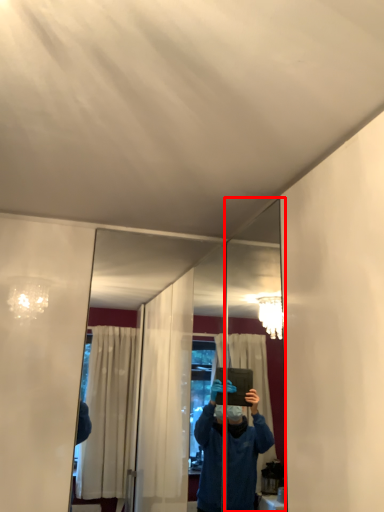
Question: From the image's perspective, considering the relative positions of mirror (annotated by the red box) and mirror in the image provided, where is mirror (annotated by the red box) located with respect to the staircase?

Choices:
 (A) below
 (B) above

Answer: (B)